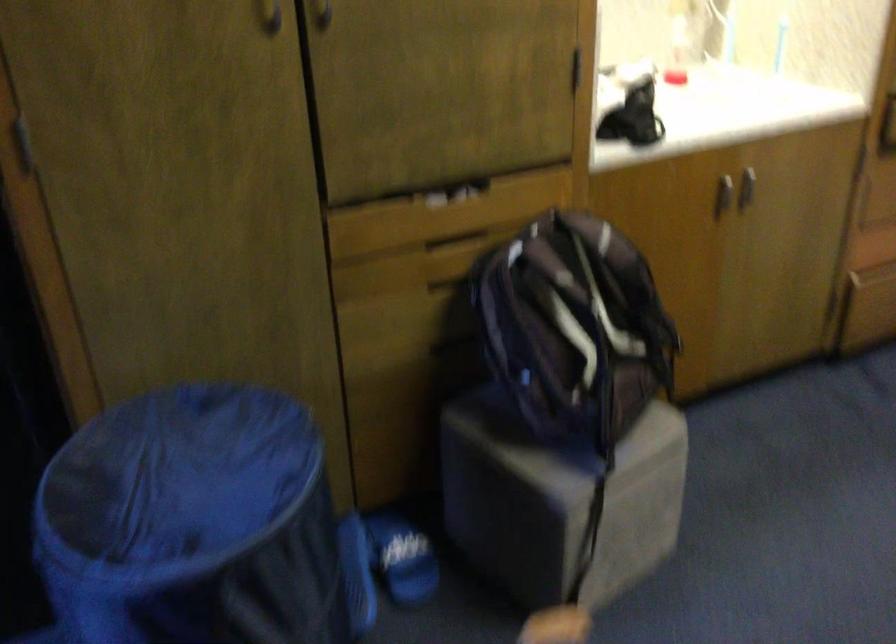
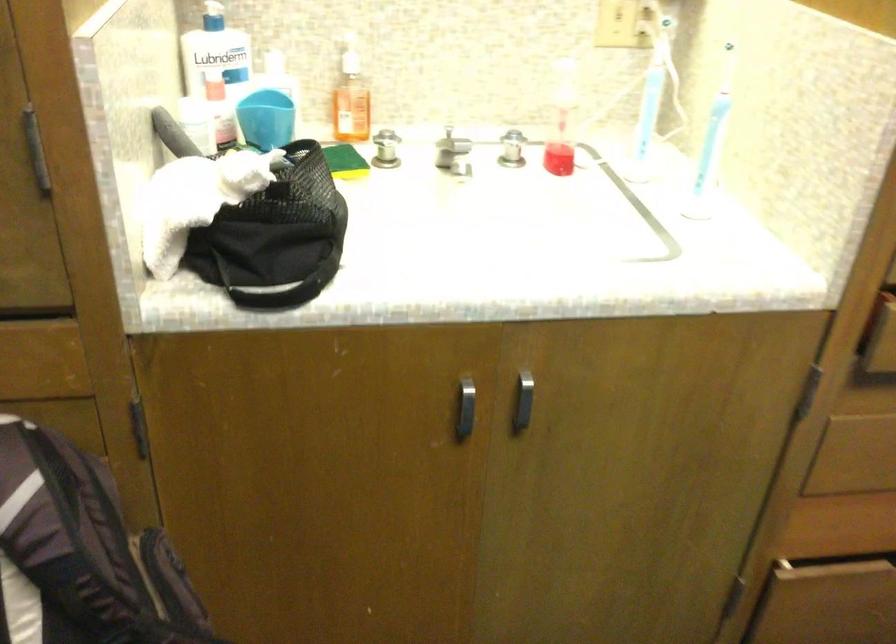
Find the pixel in the second image that matches point (634, 136) in the first image.

(279, 286)